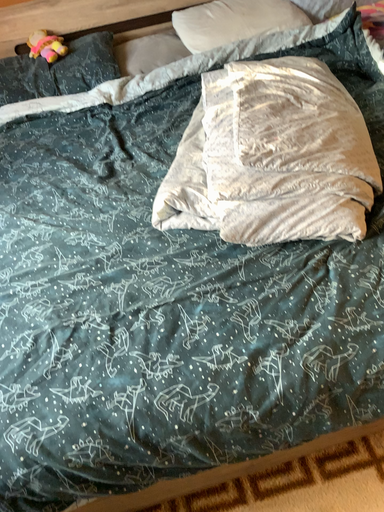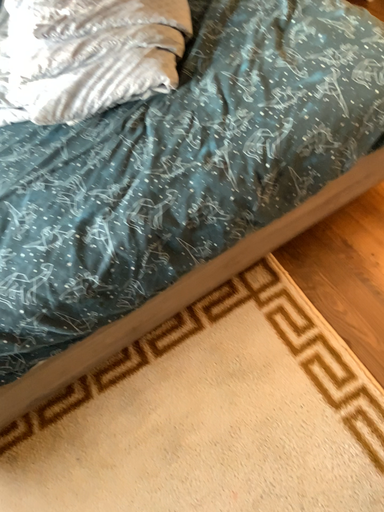
Question: Which way did the camera rotate in the video?

Choices:
 (A) rotated right
 (B) rotated left

Answer: (A)